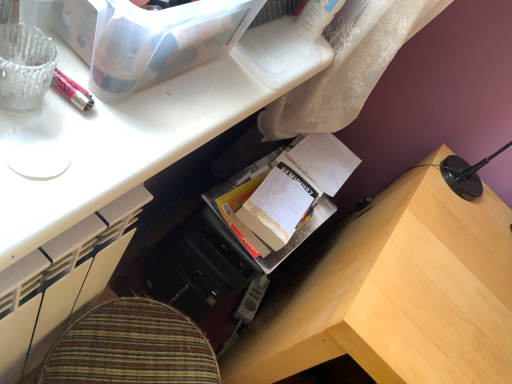
The width and height of the screenshot is (512, 384). Find the location of `empty space that is ontop of white paper notebook at center (from a real-world perspective)`. empty space that is ontop of white paper notebook at center (from a real-world perspective) is located at coordinates (281, 200).